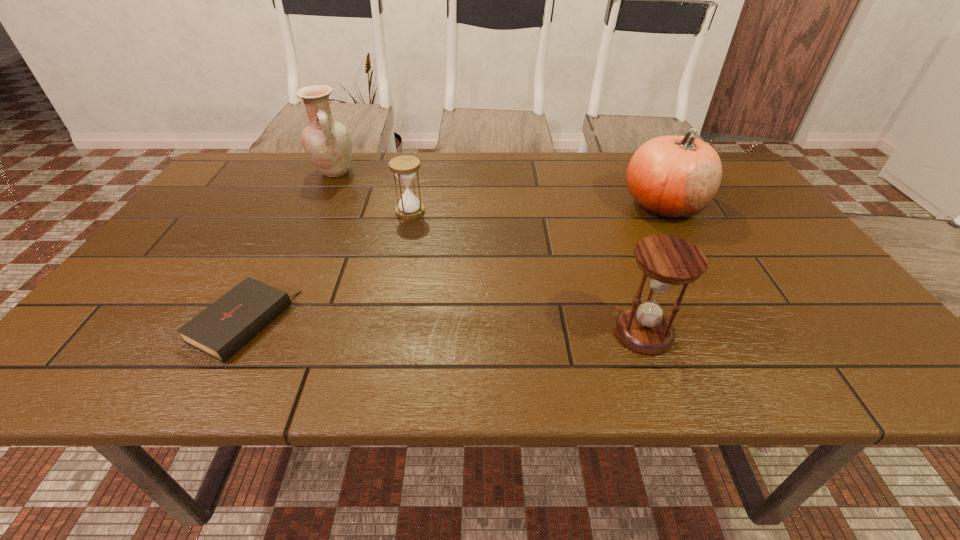
Locate an element on the screen. This screenshot has height=540, width=960. vacant space located on the right of the shorter hourglass is located at coordinates (479, 212).

Locate an element on the screen. The width and height of the screenshot is (960, 540). blank space located 0.260m on the right of the shortest object is located at coordinates (415, 323).

Identify the location of pottery at the far edge. (327, 143).

Where is `pumpkin located at the far edge`? The height and width of the screenshot is (540, 960). pumpkin located at the far edge is located at coordinates (673, 177).

Locate an element on the screen. The width and height of the screenshot is (960, 540). hourglass positioned at the near edge is located at coordinates (668, 261).

I want to click on Bible that is at the near edge, so click(x=224, y=327).

Find the location of `object present at the right edge`. object present at the right edge is located at coordinates [673, 177].

At what (x,y) coordinates should I click in order to perform the action: click on object that is at the far right corner. Please return your answer as a coordinate pair (x, y). The image size is (960, 540). Looking at the image, I should click on (673, 177).

Locate an element on the screen. The image size is (960, 540). free space at the far edge is located at coordinates (427, 167).

Locate an element on the screen. vacant space at the near edge is located at coordinates (456, 366).